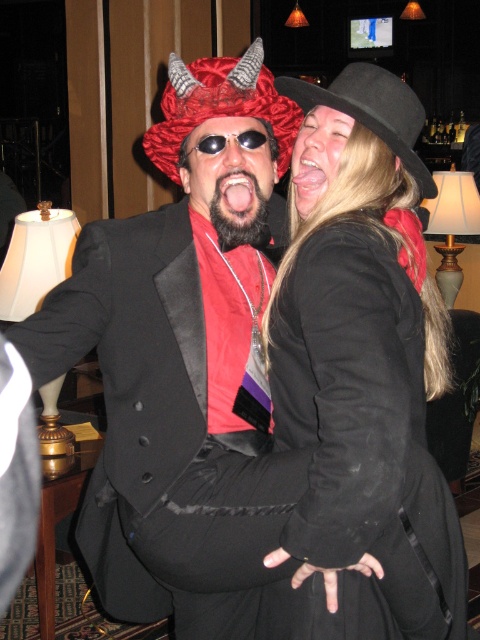
You are a photographer at a party and want to capture both the shiny red fabric hat at upper center and the black felt hat at upper right in one frame. Your camera has a maximum focus range of 7 inches. Can you fit both hats into the frame without moving the camera?

The distance between the shiny red fabric hat at upper center and the black felt hat at upper right is 7.32 inches. Since your camera can only focus within 7 inches, you cannot fit both hats into the frame without moving the camera.

Based on the photo, you are a photographer trying to capture a closeup of the sunglassesmetallicgoggles at center without including the black felt hat at upper right in the frame. Given their relative sizes, is this possible?

The black felt hat at upper right is wider than the sunglassesmetallicgoggles at center. Since the hat is wider, it might be challenging to frame the goggles without the hat overlapping unless positioned carefully.

You are at a costume party and need to find the shiny red fabric hat at upper center and the black felt hat at upper right. If you are facing the two people in the image, which hat is closer to your left side?

The shiny red fabric hat at upper center is to the left of black felt hat at upper right, so the shiny red fabric hat at upper center is closer to your left side.